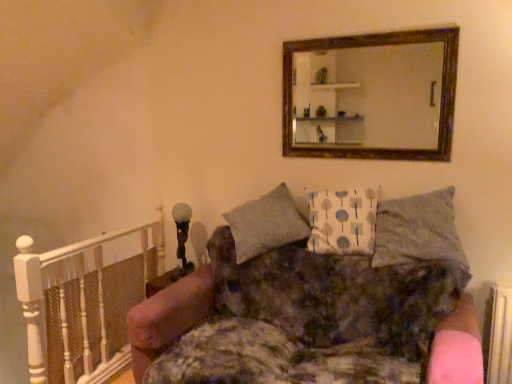
Question: Is wooden frame mirror at upper center at the back of velvet floral couch at center?

Choices:
 (A) no
 (B) yes

Answer: (A)

Question: Considering the relative sizes of velvet floral couch at center and wooden frame mirror at upper center in the image provided, is velvet floral couch at center taller than wooden frame mirror at upper center?

Choices:
 (A) yes
 (B) no

Answer: (A)

Question: Considering the relative sizes of velvet floral couch at center and wooden frame mirror at upper center in the image provided, is velvet floral couch at center shorter than wooden frame mirror at upper center?

Choices:
 (A) yes
 (B) no

Answer: (B)

Question: Is velvet floral couch at center further to camera compared to wooden frame mirror at upper center?

Choices:
 (A) yes
 (B) no

Answer: (B)

Question: Is velvet floral couch at center surrounding wooden frame mirror at upper center?

Choices:
 (A) yes
 (B) no

Answer: (B)

Question: From the image's perspective, would you say velvet floral couch at center is shown under wooden frame mirror at upper center?

Choices:
 (A) yes
 (B) no

Answer: (A)

Question: From a real-world perspective, does white painted wood balustrade at left stand above wooden frame mirror at upper center?

Choices:
 (A) no
 (B) yes

Answer: (A)

Question: Does white painted wood balustrade at left appear on the left side of wooden frame mirror at upper center?

Choices:
 (A) no
 (B) yes

Answer: (B)

Question: Considering the relative positions of white painted wood balustrade at left and wooden frame mirror at upper center in the image provided, is white painted wood balustrade at left behind wooden frame mirror at upper center?

Choices:
 (A) no
 (B) yes

Answer: (B)

Question: Is white painted wood balustrade at left shorter than wooden frame mirror at upper center?

Choices:
 (A) yes
 (B) no

Answer: (B)

Question: Is white painted wood balustrade at left wider than wooden frame mirror at upper center?

Choices:
 (A) yes
 (B) no

Answer: (A)

Question: Considering the relative positions of white painted wood balustrade at left and wooden frame mirror at upper center in the image provided, is white painted wood balustrade at left in front of wooden frame mirror at upper center?

Choices:
 (A) yes
 (B) no

Answer: (B)

Question: Is wooden frame mirror at upper center not within velvet floral couch at center?

Choices:
 (A) yes
 (B) no

Answer: (A)